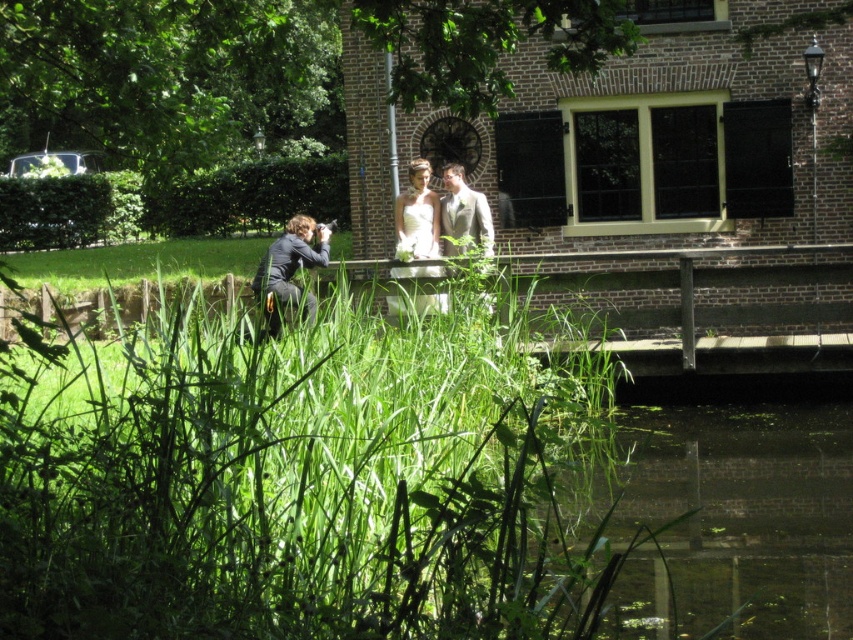
You are standing at the point closer to the photographer. Which point are you at, point (410, 168) or point (302, 262)?

Point (302, 262) is closer to the photographer than point (410, 168), so you are at point (302, 262).

You are a photographer wanting to ensure the white satin dress at upper center is visible in the photo. Given that the green leafy grass at lower center is in front of the dress, should you adjust your camera angle upwards or downwards to avoid the grass blocking the dress?

The green leafy grass at lower center is located below the white satin dress at upper center. To avoid the grass blocking the dress, you should adjust your camera angle upwards to focus on the dress above the grass.